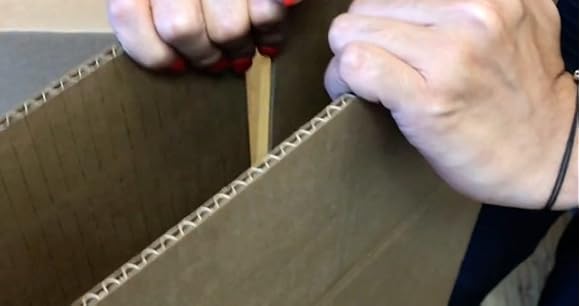
Identify the location of cardboard box. Image resolution: width=580 pixels, height=306 pixels. (137, 154), (300, 248).